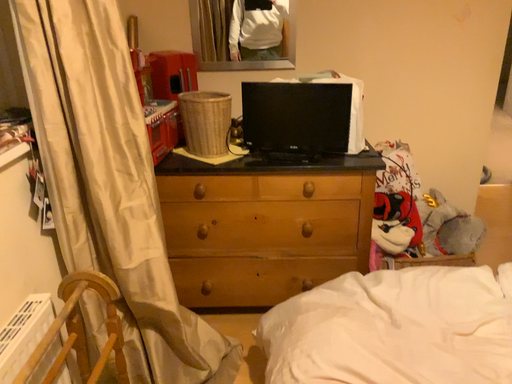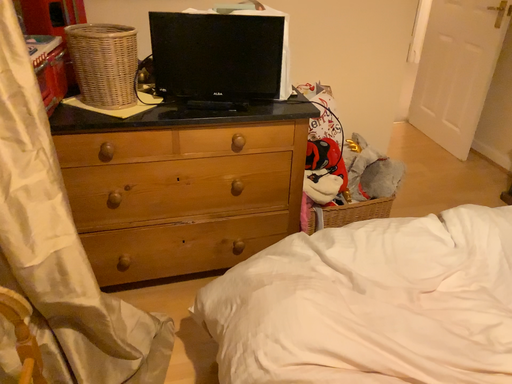
Question: Which way did the camera rotate in the video?

Choices:
 (A) rotated downward
 (B) rotated upward

Answer: (A)